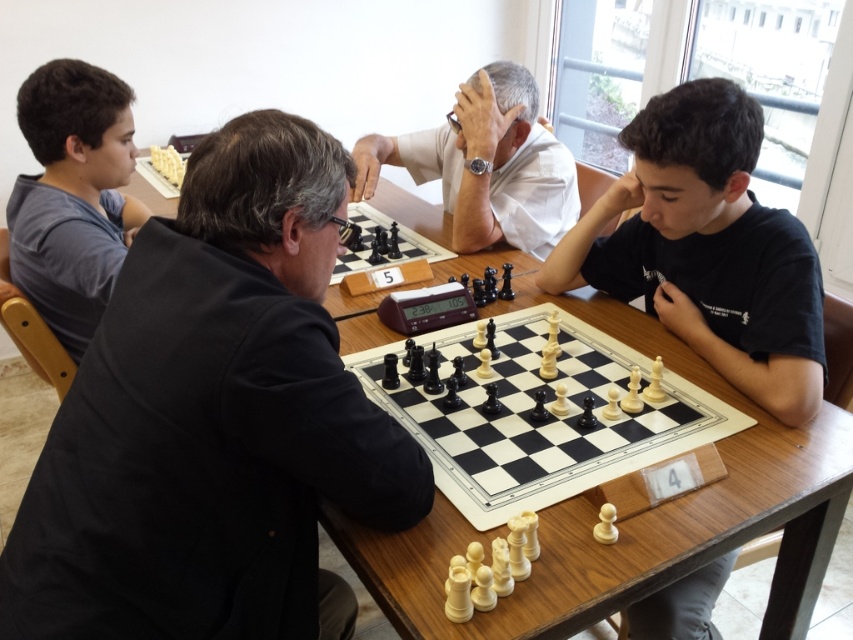
Between point (202, 212) and point (718, 179), which one is positioned in front?

Point (202, 212) is more forward.

Which of these two, black fabric shirt at left or black matte shirt at center, stands shorter?

black matte shirt at center is shorter.

Identify the location of black fabric shirt at left. (213, 419).

Where is `black fabric shirt at left`? The width and height of the screenshot is (853, 640). black fabric shirt at left is located at coordinates (213, 419).

Who is more forward, (724, 198) or (548, 147)?

Point (724, 198) is more forward.

Can you confirm if black matte shirt at center is positioned to the right of white smooth shirt at center?

Indeed, black matte shirt at center is positioned on the right side of white smooth shirt at center.

What do you see at coordinates (706, 248) in the screenshot? The height and width of the screenshot is (640, 853). I see `black matte shirt at center` at bounding box center [706, 248].

Where is `black matte shirt at center`? This screenshot has width=853, height=640. black matte shirt at center is located at coordinates (706, 248).

Does wooden chessboard at center have a lesser height compared to white smooth shirt at center?

Yes.

Which of these two, wooden chessboard at center or white smooth shirt at center, stands shorter?

wooden chessboard at center

Between point (585, 433) and point (485, 141), which one is positioned behind?

Point (485, 141)

Identify the location of wooden chessboard at center. (538, 420).